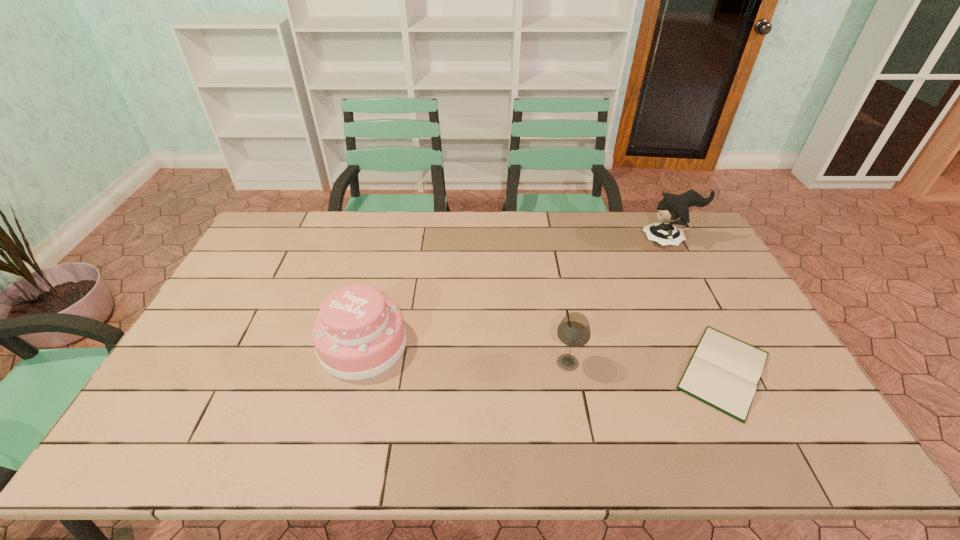
Where is `the tallest object`? This screenshot has width=960, height=540. the tallest object is located at coordinates (674, 209).

Where is `the farthest object`? This screenshot has width=960, height=540. the farthest object is located at coordinates (674, 209).

Find the location of a particular element. wineglass is located at coordinates (x=574, y=330).

You are a GUI agent. You are given a task and a screenshot of the screen. Output one action in this format:
    pyautogui.click(x=<x>, y=<y>)
    Task: Click on the leftmost object
    Image resolution: width=960 pixels, height=540 pixels.
    Given the screenshot: What is the action you would take?
    pyautogui.click(x=359, y=333)

The height and width of the screenshot is (540, 960). In order to click on hardback book in this screenshot , I will do 724,372.

Where is `vacant space located at the face of the doll`? vacant space located at the face of the doll is located at coordinates (556, 241).

This screenshot has width=960, height=540. I want to click on vacant space located at the face of the doll, so click(556, 241).

Identify the location of free location located 0.250m at the face of the doll. The height and width of the screenshot is (540, 960). (573, 241).

Locate an element on the screen. The image size is (960, 540). free space located 0.280m on the left of the wineglass is located at coordinates (448, 362).

Find the location of a particular element. free space located 0.060m on the back of the leftmost object is located at coordinates (374, 299).